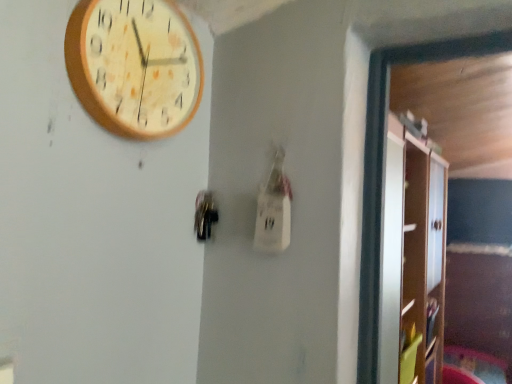
Question: Would you say metallic dark gray door handle at center is to the left or to the right of wooden clock at upper left in the picture?

Choices:
 (A) left
 (B) right

Answer: (B)

Question: Considering the positions of metallic dark gray door handle at center and wooden clock at upper left in the image, is metallic dark gray door handle at center taller or shorter than wooden clock at upper left?

Choices:
 (A) short
 (B) tall

Answer: (A)

Question: Which object is the farthest from the white glossy cabinet at right?

Choices:
 (A) wooden clock at upper left
 (B) metallic dark gray door handle at center

Answer: (B)

Question: Which object is the farthest from the wooden clock at upper left?

Choices:
 (A) metallic dark gray door handle at center
 (B) white glossy cabinet at right

Answer: (B)